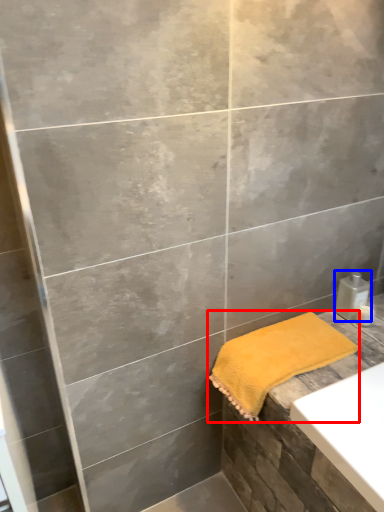
Question: Which object appears farthest to the camera in this image, towel (highlighted by a red box) or soap dispenser (highlighted by a blue box)?

Choices:
 (A) towel
 (B) soap dispenser

Answer: (B)